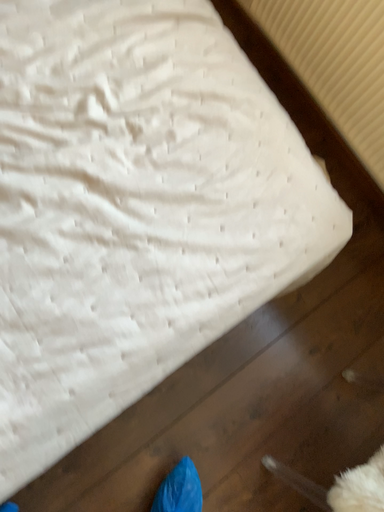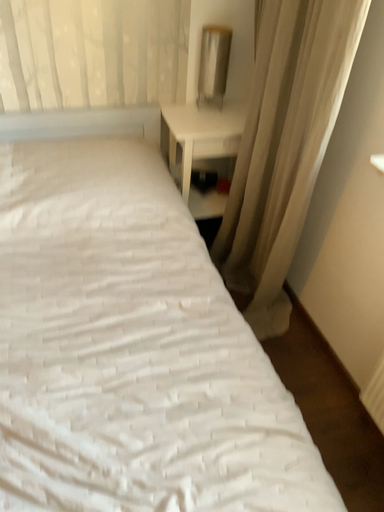
Question: Which way did the camera rotate in the video?

Choices:
 (A) rotated upward
 (B) rotated downward

Answer: (A)